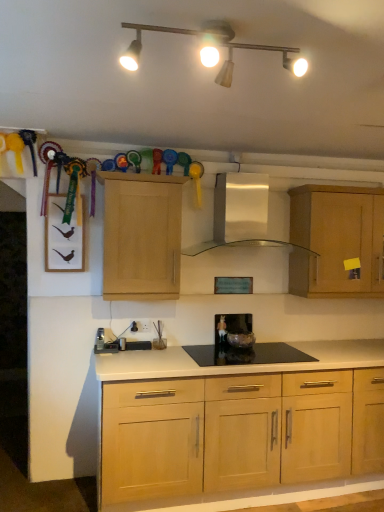
Question: Is matte glass bowl at center, the 1th appliance viewed from the right, next to matte white track lights at upper center?

Choices:
 (A) no
 (B) yes

Answer: (A)

Question: From the image's perspective, is matte glass bowl at center, which ranks as the second appliance in front-to-back order, beneath matte white track lights at upper center?

Choices:
 (A) yes
 (B) no

Answer: (A)

Question: Does matte glass bowl at center, which is the second appliance from left to right, contain matte white track lights at upper center?

Choices:
 (A) yes
 (B) no

Answer: (B)

Question: Can you confirm if matte glass bowl at center, the 1th appliance viewed from the right, is bigger than matte white track lights at upper center?

Choices:
 (A) no
 (B) yes

Answer: (A)

Question: Does matte glass bowl at center, which is counted as the 1th appliance, starting from the back, have a greater width compared to matte white track lights at upper center?

Choices:
 (A) no
 (B) yes

Answer: (A)

Question: In terms of height, does white plastic electric outlet at lower center look taller or shorter compared to light wood cabinet at center, the 2th cabinetry positioned from the right?

Choices:
 (A) tall
 (B) short

Answer: (B)

Question: Considering the positions of point (137, 324) and point (137, 180), is point (137, 324) closer or farther from the camera than point (137, 180)?

Choices:
 (A) farther
 (B) closer

Answer: (A)

Question: From the image's perspective, is white plastic electric outlet at lower center located above or below light wood cabinet at center, arranged as the 1th cabinetry when viewed from the left?

Choices:
 (A) above
 (B) below

Answer: (B)

Question: Is white plastic electric outlet at lower center spatially inside light wood cabinet at center, arranged as the 1th cabinetry when viewed from the left, or outside of it?

Choices:
 (A) inside
 (B) outside

Answer: (B)

Question: Based on their positions, is white glossy range hood at center located to the left or right of satin silver toaster at lower left, positioned as the second appliance in right-to-left order?

Choices:
 (A) left
 (B) right

Answer: (B)

Question: Considering the positions of point (259, 181) and point (102, 334), is point (259, 181) closer or farther from the camera than point (102, 334)?

Choices:
 (A) closer
 (B) farther

Answer: (B)

Question: Considering their positions, is white glossy range hood at center located in front of or behind satin silver toaster at lower left, positioned as the second appliance in right-to-left order?

Choices:
 (A) front
 (B) behind

Answer: (A)

Question: From a real-world perspective, relative to satin silver toaster at lower left, arranged as the second appliance when viewed from the back, is white glossy range hood at center vertically above or below?

Choices:
 (A) above
 (B) below

Answer: (A)

Question: Is white plastic electric outlet at lower center to the left or to the right of light wood cabinet at upper right, which is the 1th cabinetry in right-to-left order, in the image?

Choices:
 (A) left
 (B) right

Answer: (A)

Question: In terms of width, does white plastic electric outlet at lower center look wider or thinner when compared to light wood cabinet at upper right, which ranks as the second cabinetry in left-to-right order?

Choices:
 (A) thin
 (B) wide

Answer: (A)